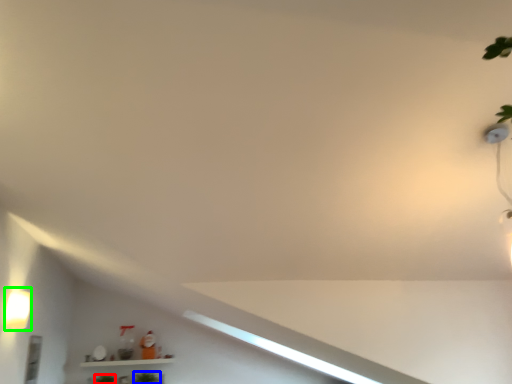
Question: Considering the real-world distances, which object is farthest from plant (highlighted by a red box)? plant (highlighted by a blue box) or light fixture (highlighted by a green box)?

Choices:
 (A) plant
 (B) light fixture

Answer: (B)